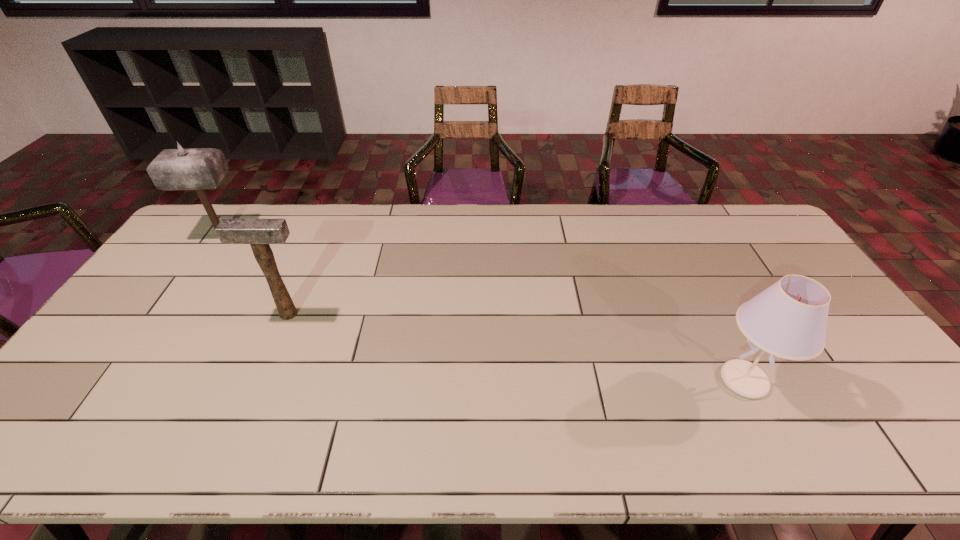
In order to click on the farther mallet in this screenshot , I will do `click(198, 169)`.

In order to click on the leftmost object in this screenshot , I will do `click(198, 169)`.

Find the location of a particular element. the right mallet is located at coordinates (259, 233).

You are a GUI agent. You are given a task and a screenshot of the screen. Output one action in this format:
    pyautogui.click(x=<x>, y=<y>)
    Task: Click on the second object from left to right
    
    Given the screenshot: What is the action you would take?
    pyautogui.click(x=259, y=233)

Find the location of a particular element. The image size is (960, 540). lampshade is located at coordinates pos(788,320).

Image resolution: width=960 pixels, height=540 pixels. Identify the location of the rightmost object. (788, 320).

What are the coordinates of `free space located 0.220m on the right of the left mallet` in the screenshot? It's located at (312, 237).

This screenshot has width=960, height=540. I want to click on free point located on the front of the second nearest object, so click(254, 394).

This screenshot has height=540, width=960. I want to click on blank area located on the front of the rightmost object, so click(779, 449).

The width and height of the screenshot is (960, 540). I want to click on object at the far edge, so click(198, 169).